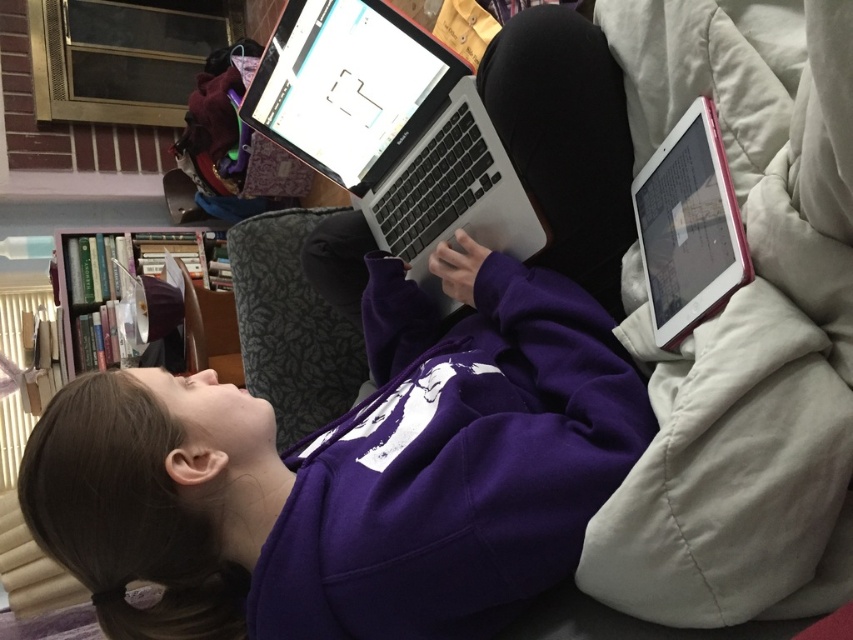
You are a delivery robot trying to place a package on the couch. The couch has a dark patterned fabric. You need to avoid placing the package on the silver metallic laptop at center. Where should you place the package so it doesn not land on the laptop? Use the coordinates to specify the safe area. The laptop is located at point (390,131). The couch is a rectangle from 0.0 to 1.0 on both axes. The safe area must be a rectangle that does not include the laptop area. The answer should include the minimum x

The safe area for placing the package should exclude the coordinates where the laptop is located. Since the laptop is at point (390,131), the safe area can be defined as a rectangle from x minimum 0.0 to x maximum 0.204 and y minimum 0.0 to y maximum 1.0, and another rectangle from x minimum 0.206 to x maximum 1.0 and y minimum 0.0 to y maximum 1.0. This ensures the package avoids the laptop area.

You are an interior designer assessing the living room layout. The purple fleece sweatshirt at center is placed between the wooden bookshelf at left and a window. Can you determine which object is wider?

The purple fleece sweatshirt at center has a lesser width compared to the wooden bookshelf at left, so the wooden bookshelf at left is wider.